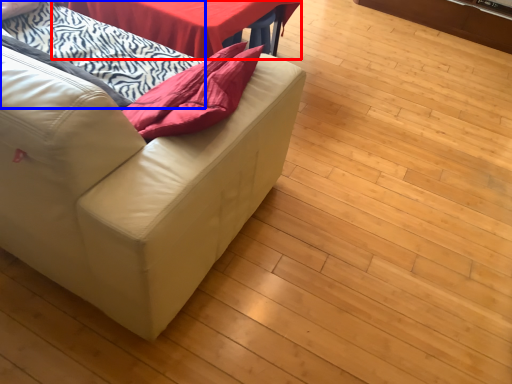
Question: Among these objects, which one is farthest to the camera, table (highlighted by a red box) or blanket (highlighted by a blue box)?

Choices:
 (A) table
 (B) blanket

Answer: (A)